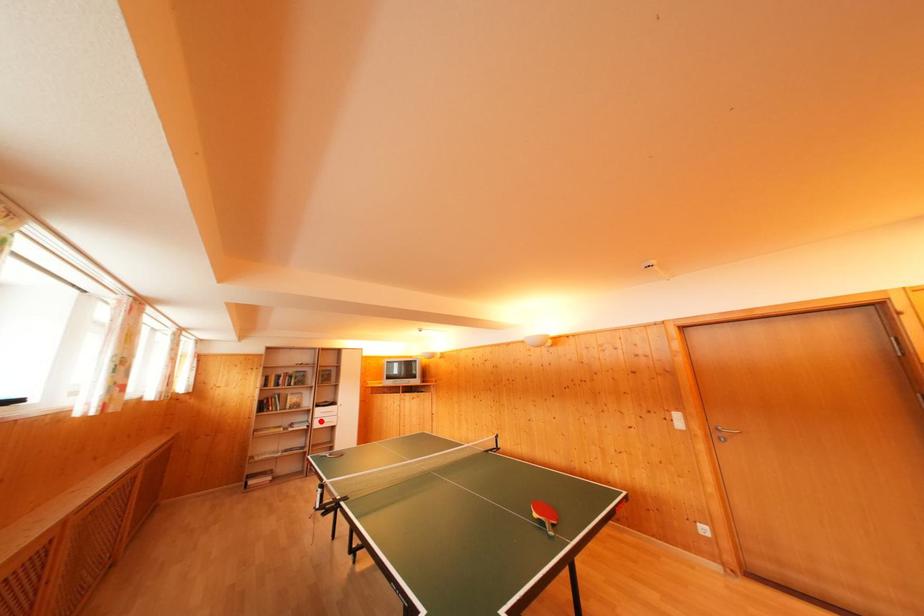
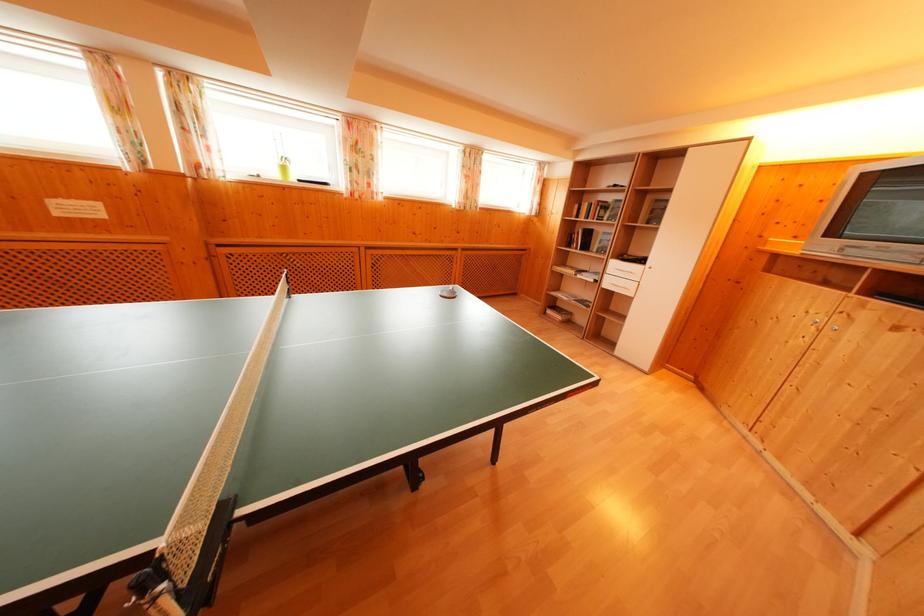
Find the pixel in the second image that matches the highlighted location in the first image.

(614, 276)